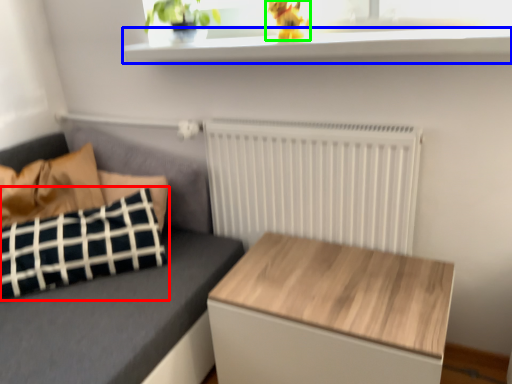
Question: Which object is the closest to the pillow (highlighted by a red box)? Choose among these: window sill (highlighted by a blue box) or animal (highlighted by a green box).

Choices:
 (A) window sill
 (B) animal

Answer: (A)